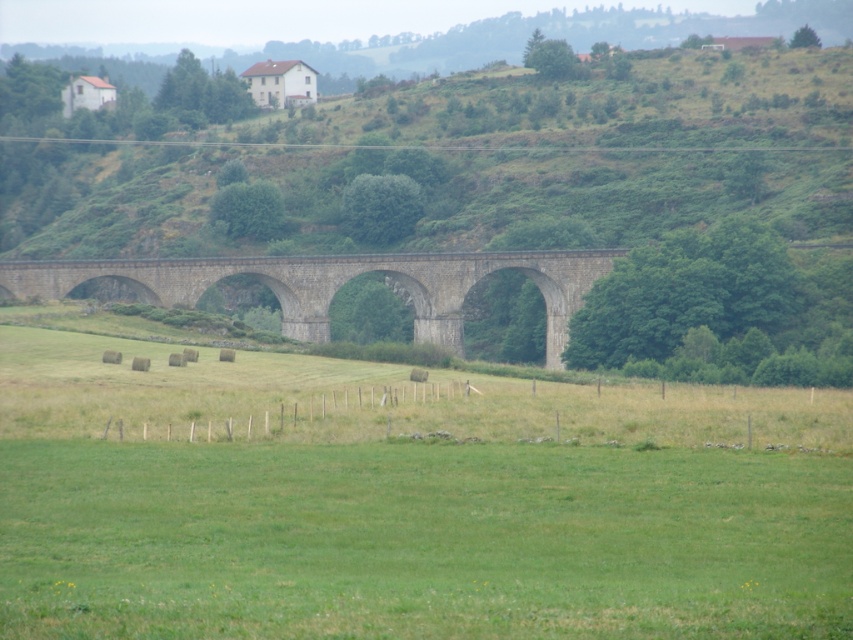
You are standing at the viewpoint of the image and want to walk towards the bridge. Which point, point (347, 544) or point (537, 269), would you encounter first?

Point (347, 544) is in front of point (537, 269), so you would encounter point (347, 544) first.

You are standing on the gray stone bridge at center and want to reach the green grassy field at center. Which direction should you move to get there?

You should move to the right to reach the green grassy field at center because it is located to the right of the gray stone bridge at center.